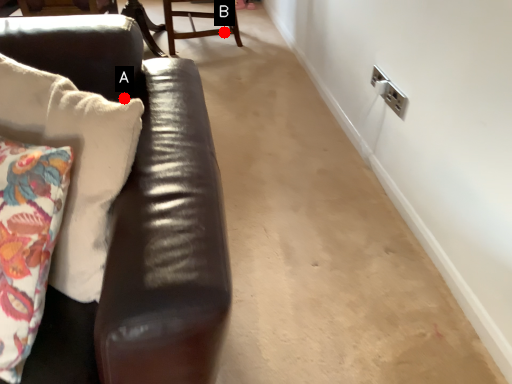
Question: Two points are circled on the image, labeled by A and B beside each circle. Which of the following is the farthest from the observer?

Choices:
 (A) A is further
 (B) B is further

Answer: (B)